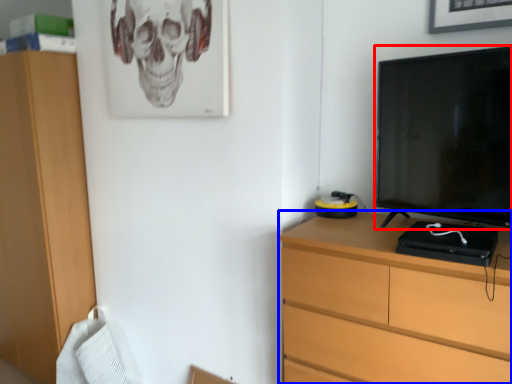
Question: Which of the following is the farthest to the observer, television (highlighted by a red box) or chest of drawers (highlighted by a blue box)?

Choices:
 (A) television
 (B) chest of drawers

Answer: (A)